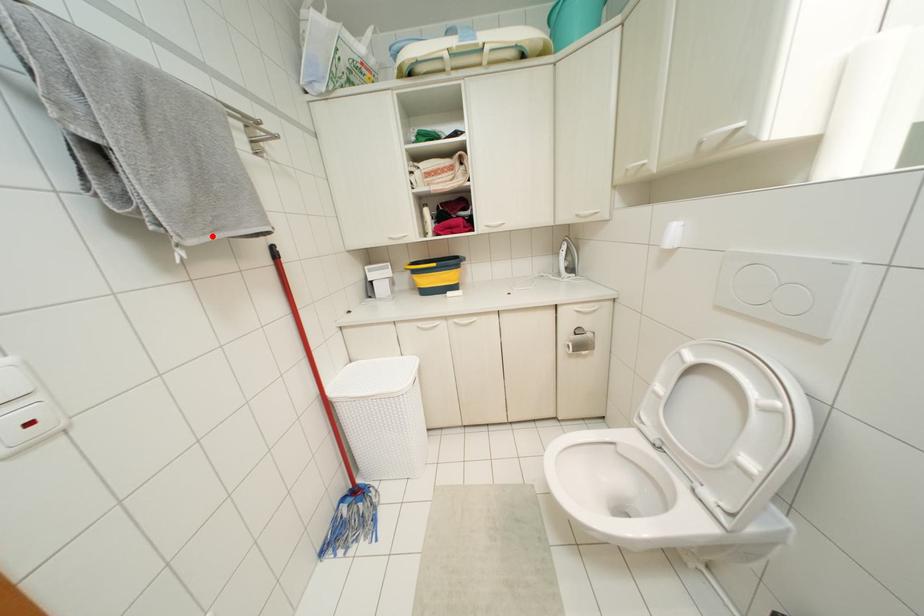
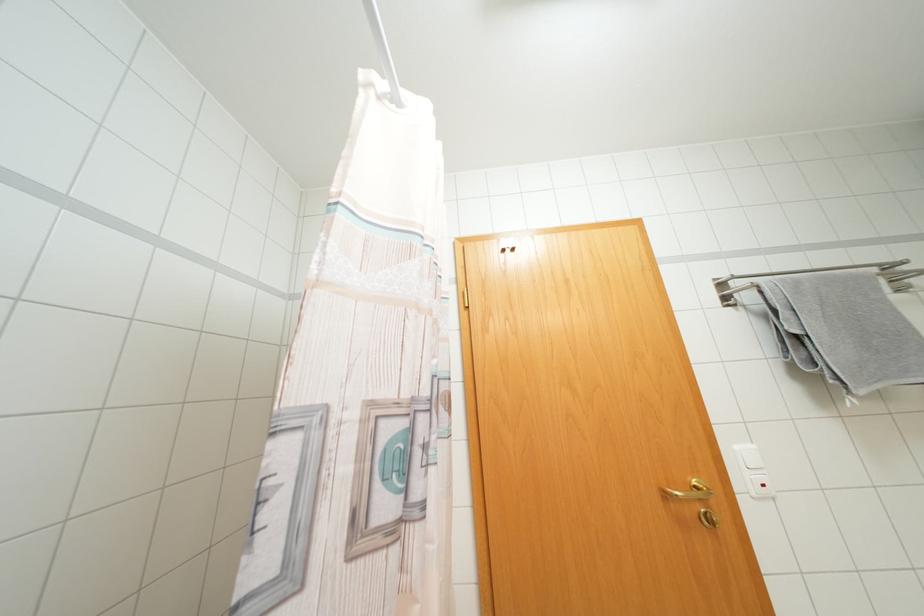
Question: I am providing you with two images of the same scene from different viewpoints. In image1, a red point is highlighted. Considering the same 3D point in image2, which of the following is correct?

Choices:
 (A) It is closer
 (B) It is farther

Answer: (A)